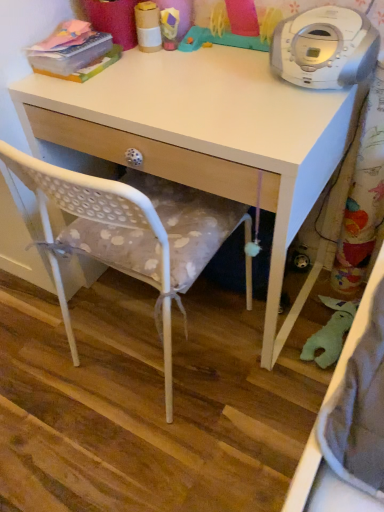
Locate an element on the screen. This screenshot has height=512, width=384. blank space to the left of rubber duck at upper center, which is the first toy from right to left is located at coordinates (164, 71).